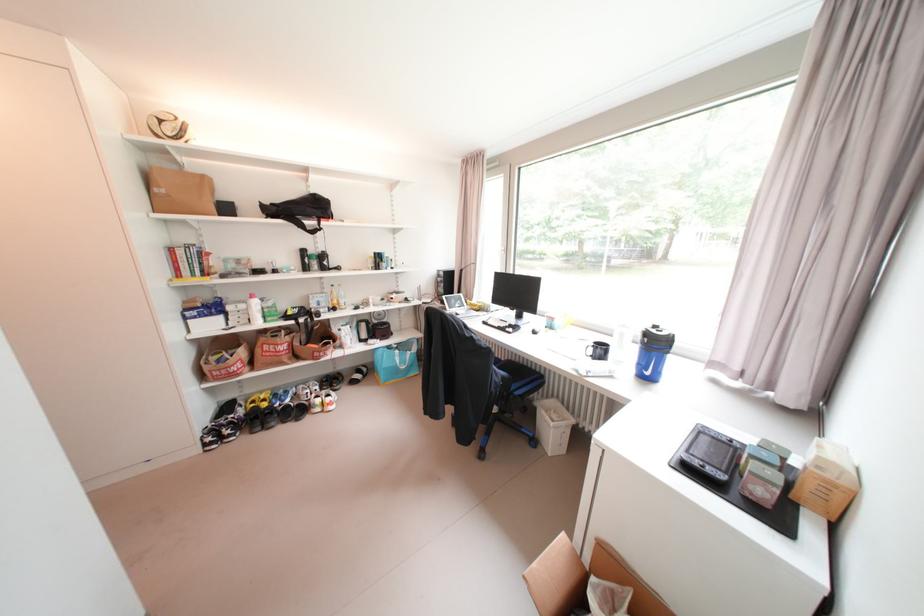
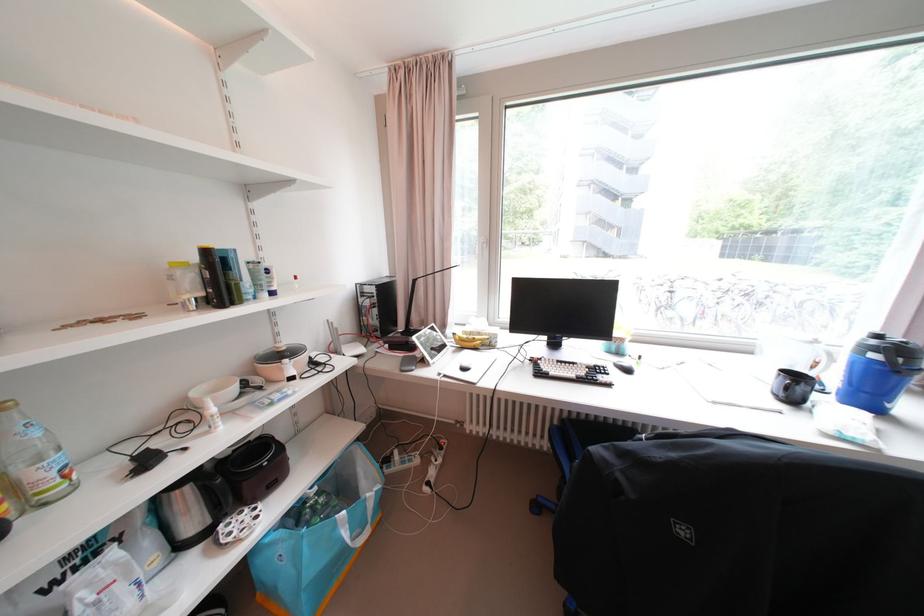
In the second image, find the point that corresponds to point 407,363 in the first image.

(354, 537)